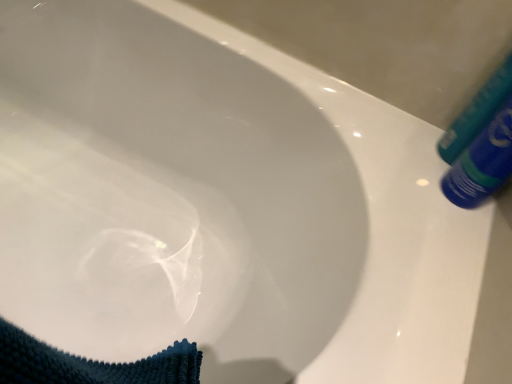
This screenshot has height=384, width=512. Find the location of `vacant region in front of blue plastic tube at upper right, placed as the 1th tube when sorted from top to bottom`. vacant region in front of blue plastic tube at upper right, placed as the 1th tube when sorted from top to bottom is located at coordinates (434, 226).